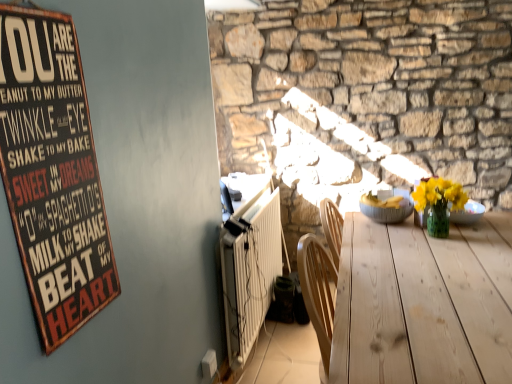
Question: From a real-world perspective, is gray textured bowl at center positioned above or below wooden signboard at left?

Choices:
 (A) above
 (B) below

Answer: (B)

Question: Considering the positions of point (403, 210) and point (49, 246), is point (403, 210) closer or farther from the camera than point (49, 246)?

Choices:
 (A) farther
 (B) closer

Answer: (A)

Question: Estimate the real-world distances between objects in this image. Which object is closer to the gray textured bowl at center?

Choices:
 (A) light wood table at center
 (B) wooden signboard at left
 (C) white ribbed radiator at lower left

Answer: (A)

Question: Based on their relative distances, which object is nearer to the light wood table at center?

Choices:
 (A) wooden signboard at left
 (B) white ribbed radiator at lower left
 (C) gray textured bowl at center

Answer: (C)